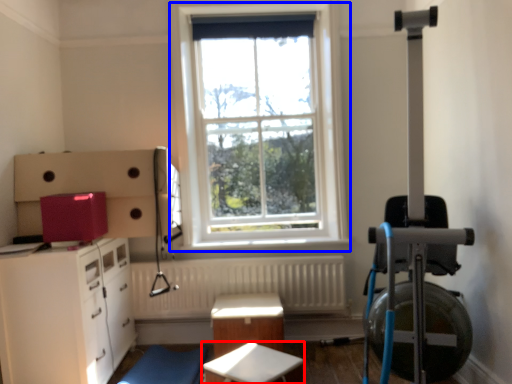
Question: Which point is further to the camera, table (highlighted by a red box) or window (highlighted by a blue box)?

Choices:
 (A) table
 (B) window

Answer: (B)